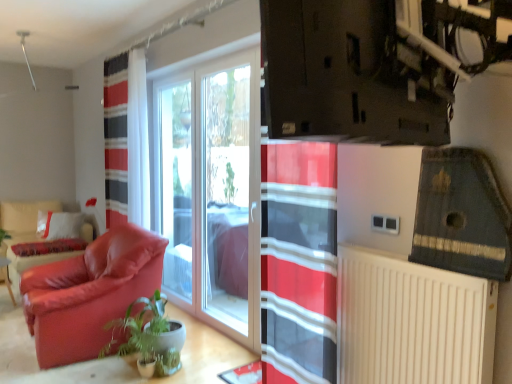
Locate an element on the screen. Image resolution: width=512 pixels, height=384 pixels. vacant space situated above white plastic radiator at lower right (from a real-world perspective) is located at coordinates (424, 263).